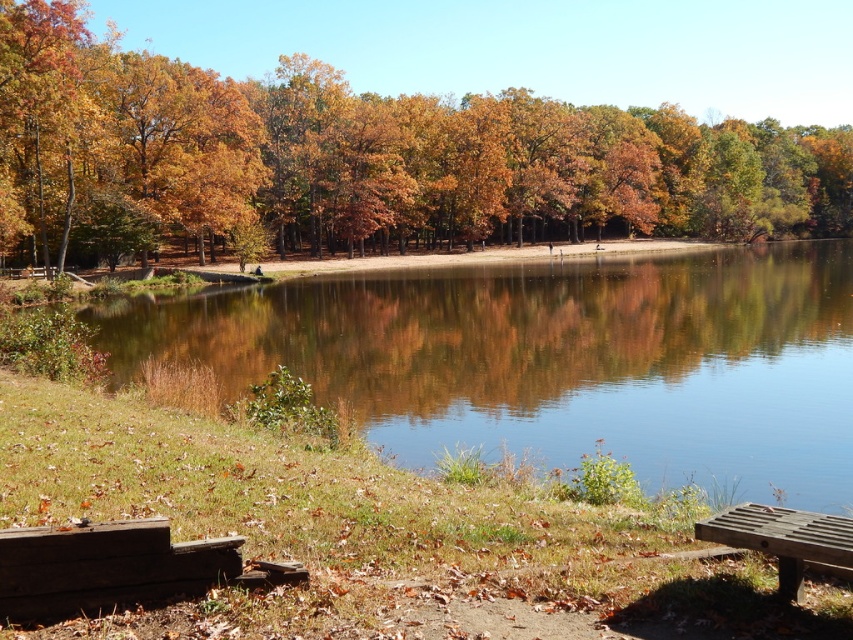
You are standing at the lakeside and notice a specific point marked at coordinates point (364, 157). Based on the scene description, what can you observe at that location?

At point (364, 157), you can observe golden brown leaves at center.

You are planning to take a photo of the wooden bench at lower right but want to ensure it is fully visible. Since the clear water at center might obstruct the view, can you determine if the bench is behind the water or in front of it?

The clear water at center is positioned over wooden bench at lower right, meaning the bench is behind the water and may not be fully visible in the photo.